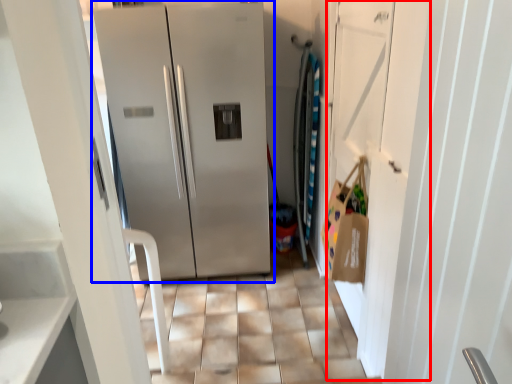
Question: Among these objects, which one is farthest to the camera, door (highlighted by a red box) or refrigerator (highlighted by a blue box)?

Choices:
 (A) door
 (B) refrigerator

Answer: (B)